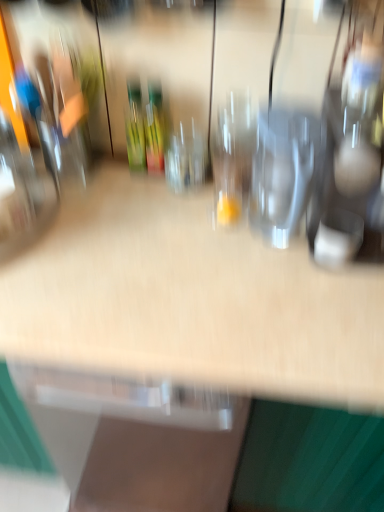
I want to click on free location in front of transparent glass at center, which appears as the second wine glass when viewed from the left, so click(x=199, y=231).